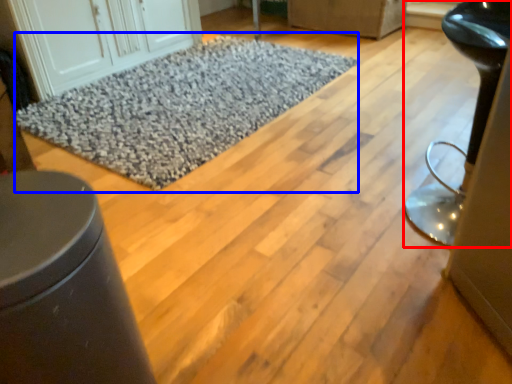
Question: Among these objects, which one is farthest to the camera, furniture (highlighted by a red box) or mat (highlighted by a blue box)?

Choices:
 (A) furniture
 (B) mat

Answer: (B)